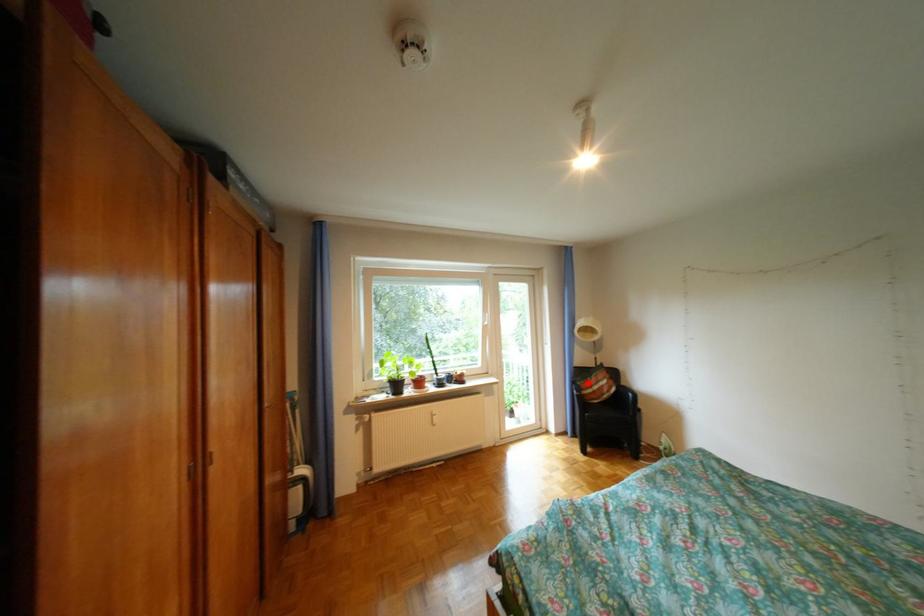
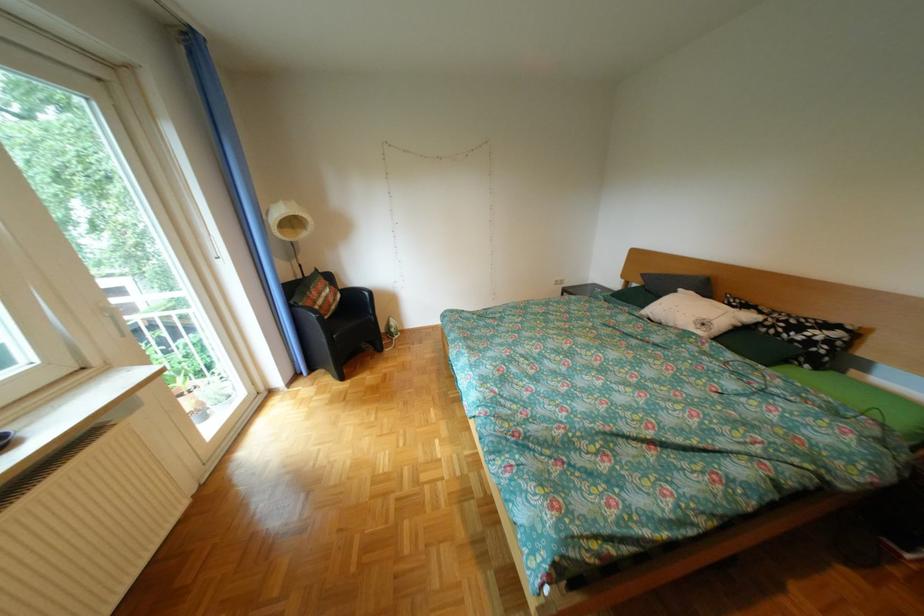
Where in the second image is the point corresponding to the highlighted location from the first image?

(306, 307)